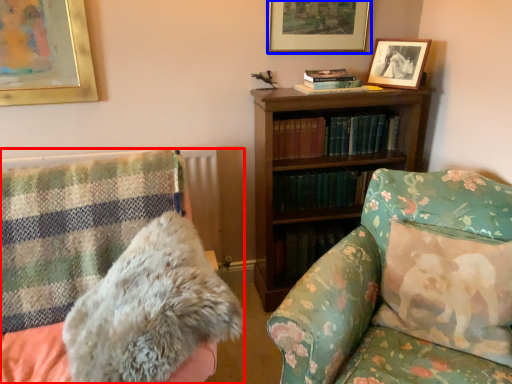
Question: Which object appears closest to the camera in this image, furniture (highlighted by a red box) or picture frame (highlighted by a blue box)?

Choices:
 (A) furniture
 (B) picture frame

Answer: (A)